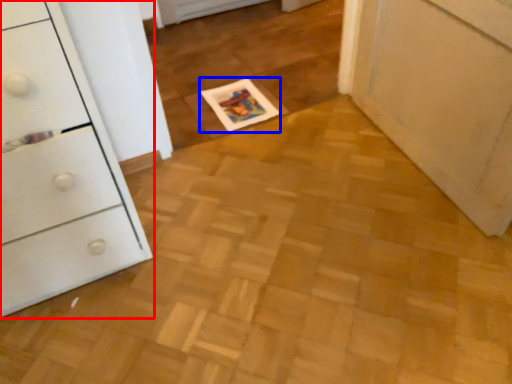
Question: Which point is closer to the camera, chest of drawers (highlighted by a red box) or magazine (highlighted by a blue box)?

Choices:
 (A) chest of drawers
 (B) magazine

Answer: (A)